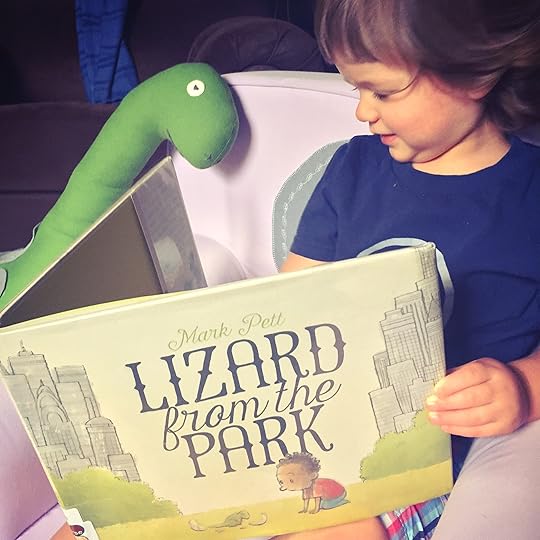
Find the location of a particular element. This screenshot has height=540, width=540. book is located at coordinates (346, 417).